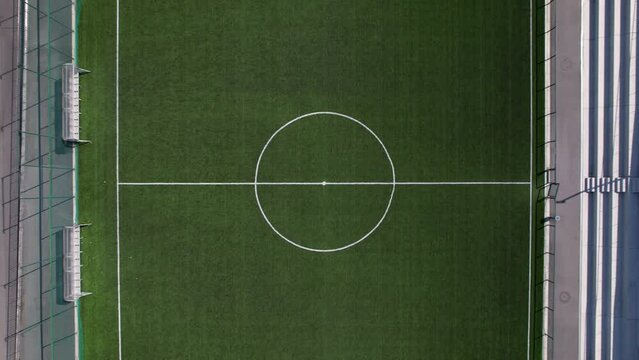
Where is `bench`? The image size is (639, 360). bench is located at coordinates [x=73, y=114].